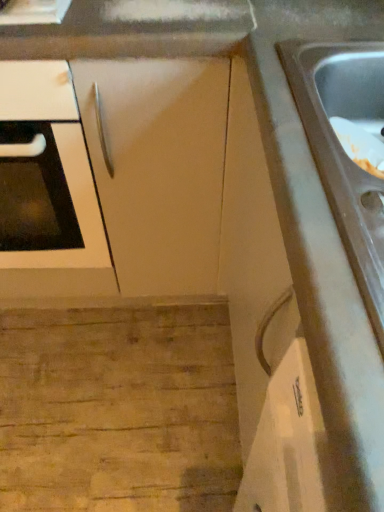
Question: Is matte white cabinet at center bigger or smaller than white glossy oven at left?

Choices:
 (A) big
 (B) small

Answer: (B)

Question: Choose the correct answer: Is matte white cabinet at center inside white glossy oven at left or outside it?

Choices:
 (A) outside
 (B) inside

Answer: (A)

Question: Which object is the farthest from the matte white cabinet at center?

Choices:
 (A) stainless steel sink at right
 (B) white glossy oven at left

Answer: (A)

Question: Based on their relative distances, which object is nearer to the stainless steel sink at right?

Choices:
 (A) matte white cabinet at center
 (B) white glossy oven at left

Answer: (A)